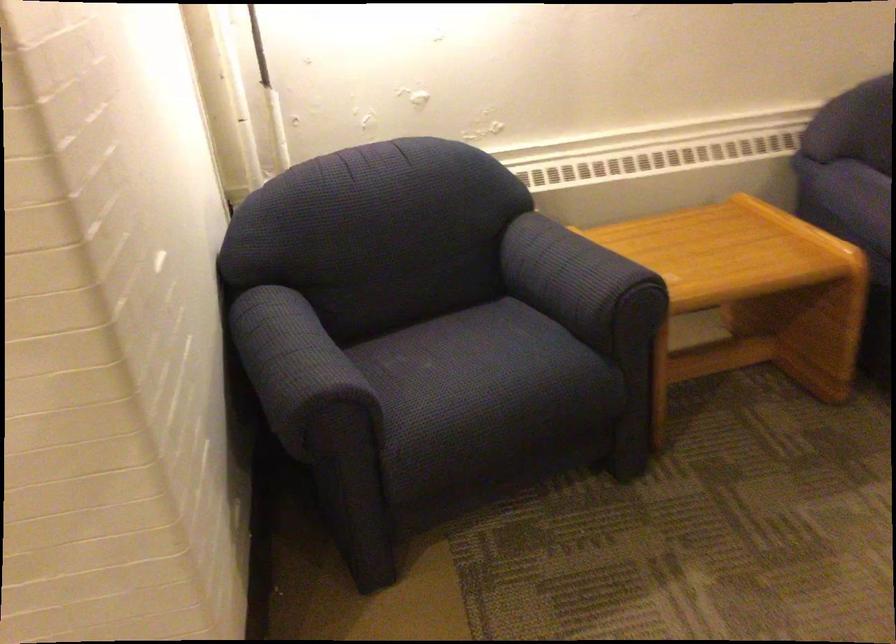
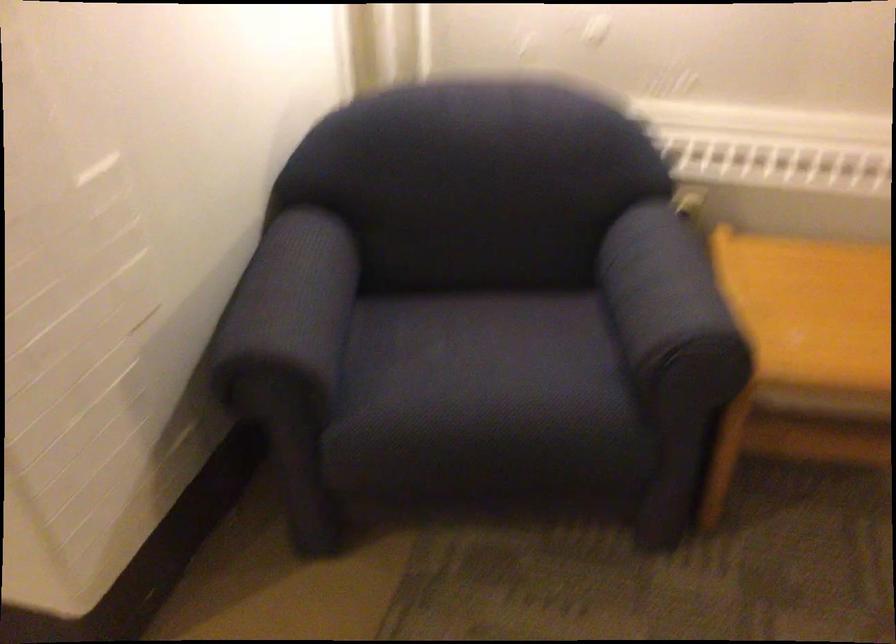
Based on the photo, which direction would the cameraman need to move to produce the second image?

The movement direction of the cameraman is right, forward.